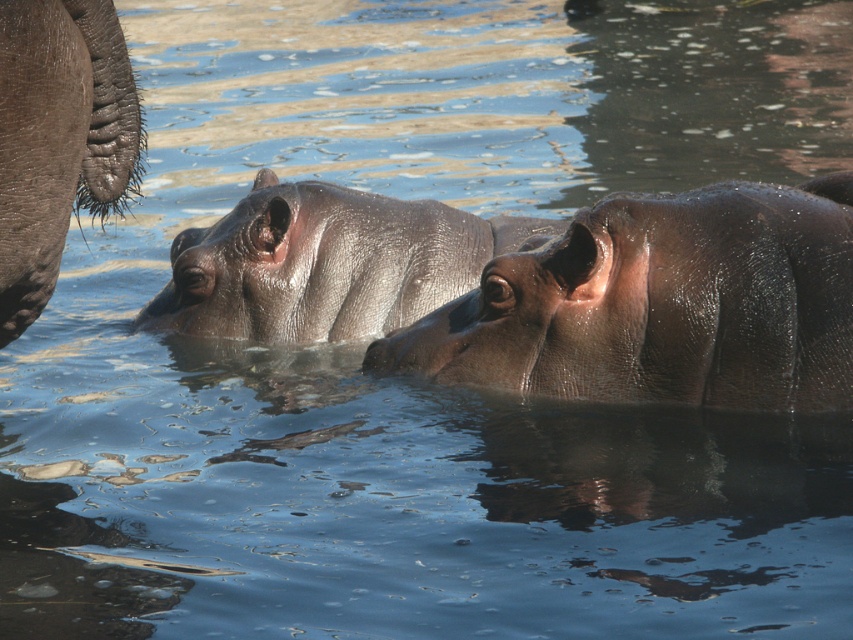
In the scene shown: You are a wildlife photographer aiming to capture a closeup of the slick gray hippo at center and the gray textured skin at left. Given that your camera lens can only focus on one object at a time, which hippo should you focus on first to ensure it appears larger in the photo?

The slick gray hippo at center is taller than the gray textured skin at left, so focusing on the slick gray hippo at center first will make it appear larger in the photo.

You are observing the scene from a boat anchored near the hippos. There are two hippos visible, one of which is the shiny brown hippo at center. Which hippo is positioned closer to the center of the water surface?

The shiny brown hippo at center is positioned closer to the center of the water surface as it is located at point coordinates that place it centrally.

You are a wildlife photographer observing the hippos from a boat. You want to capture a photo where both the shiny brown hippo at center and the gray textured skin at left are visible. Based on their positions, which hippo should you focus on first to ensure both are in the frame?

The shiny brown hippo at center is below the gray textured skin at left, so you should focus on the gray textured skin at left first to ensure both are in the frame.